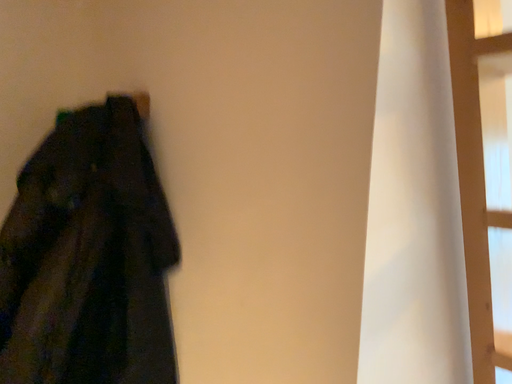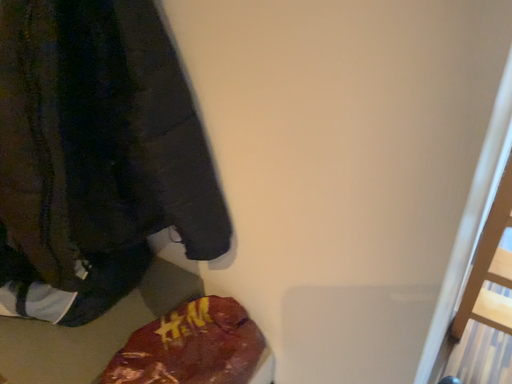
Question: How did the camera likely rotate when shooting the video?

Choices:
 (A) rotated downward
 (B) rotated upward

Answer: (A)